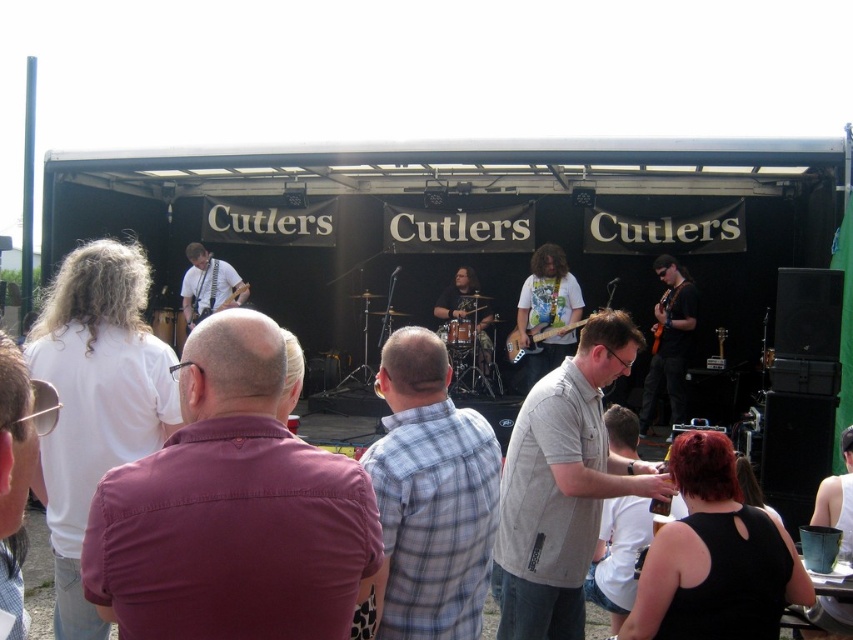
Between white t-shirt with graphic print at center and matte black guitar at center, which one is positioned lower?

Positioned lower is white t-shirt with graphic print at center.

Does point (531, 330) lie behind point (218, 273)?

No.

In the scene shown: Who is more forward, (554, 355) or (236, 301)?

Positioned in front is point (554, 355).

Find the location of a particular element. white t-shirt with graphic print at center is located at coordinates (547, 310).

Is gray cotton shirt at center shorter than matte black guitar at center?

Incorrect, gray cotton shirt at center's height does not fall short of matte black guitar at center's.

Locate an element on the screen. This screenshot has height=640, width=853. gray cotton shirt at center is located at coordinates (563, 484).

Where is `gray cotton shirt at center`? gray cotton shirt at center is located at coordinates (563, 484).

You are a GUI agent. You are given a task and a screenshot of the screen. Output one action in this format:
    pyautogui.click(x=<x>, y=<y>)
    Task: Click on the gray cotton shirt at center
    This screenshot has height=640, width=853.
    Given the screenshot: What is the action you would take?
    pyautogui.click(x=563, y=484)

Can you confirm if gray cotton shirt at center is positioned above white t-shirt with graphic print at center?

No.

Based on the photo, is gray cotton shirt at center further to the viewer compared to white t-shirt with graphic print at center?

No, gray cotton shirt at center is closer to the viewer.

Measure the distance between gray cotton shirt at center and camera.

A distance of 15.51 feet exists between gray cotton shirt at center and camera.

Image resolution: width=853 pixels, height=640 pixels. I want to click on gray cotton shirt at center, so click(563, 484).